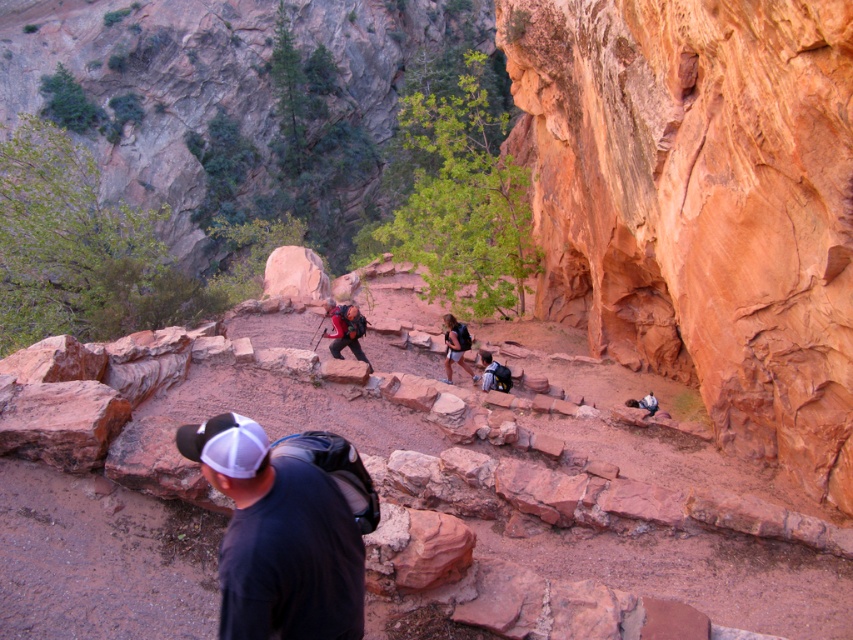
Question: Based on their relative distances, which object is nearer to the matte black backpack at center?

Choices:
 (A) black fabric backpack at lower center
 (B) rustic sandstone cliff at right

Answer: (B)

Question: From the image, what is the correct spatial relationship of rustic sandstone cliff at right in relation to matte black backpack at center?

Choices:
 (A) right
 (B) left

Answer: (A)

Question: Is black fabric backpack at lower center to the right of matte black backpack at center from the viewer's perspective?

Choices:
 (A) no
 (B) yes

Answer: (A)

Question: Which point is farther to the camera?

Choices:
 (A) black fabric backpack at lower center
 (B) rustic sandstone cliff at right
 (C) matte black backpack at center

Answer: (C)

Question: Can you confirm if rustic sandstone cliff at right is positioned above black fabric backpack at lower center?

Choices:
 (A) no
 (B) yes

Answer: (B)

Question: Considering the real-world distances, which object is farthest from the black fabric backpack at lower center?

Choices:
 (A) rustic sandstone cliff at right
 (B) matte black backpack at center

Answer: (B)